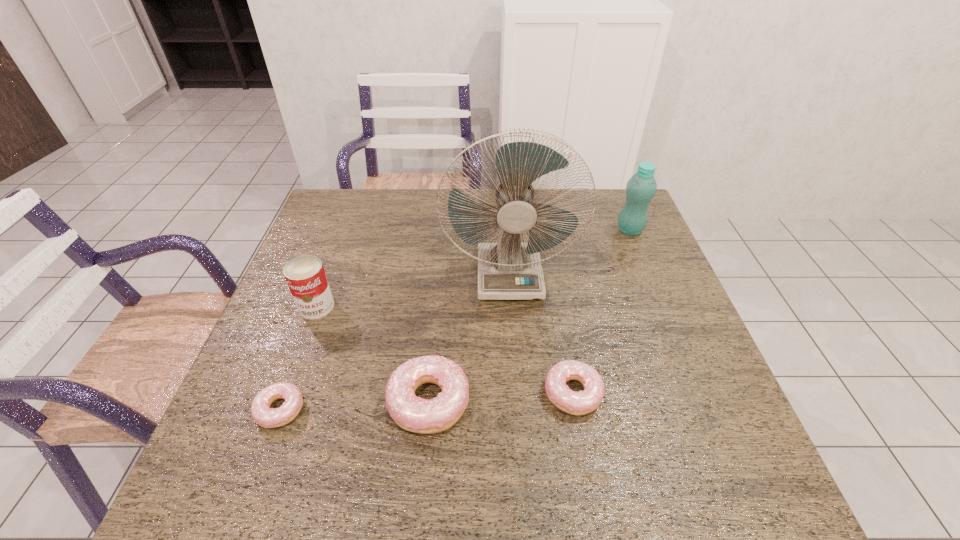
With all doughnuts evenly spaced, where should an extra doughnut be placed on the right to continue the pattern? Please point out a vacant space. Please provide its 2D coordinates. Your answer should be formatted as a tuple, i.e. [(x, y)], where the tuple contains the x and y coordinates of a point satisfying the conditions above.

[(713, 385)]